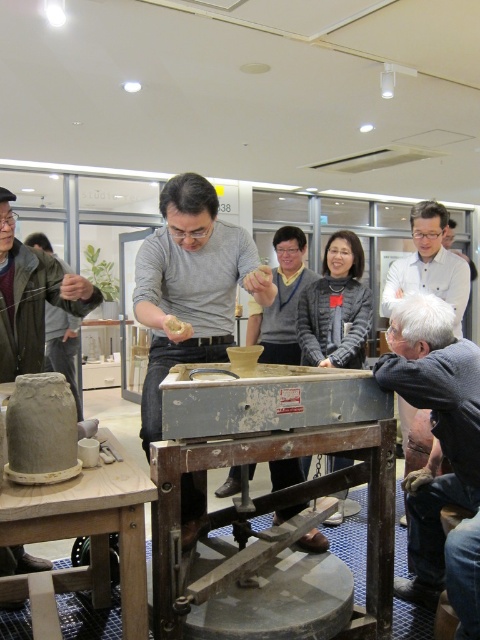
Question: Which object is farther from the camera taking this photo?

Choices:
 (A) rusty metal table at center
 (B) wooden table at lower left

Answer: (A)

Question: Does wooden table at lower left come behind gray wool sweater at center?

Choices:
 (A) no
 (B) yes

Answer: (A)

Question: Does rusty metal table at center appear under matte gray clay pot at left?

Choices:
 (A) no
 (B) yes

Answer: (B)

Question: Does rusty metal table at center have a greater width compared to wooden table at lower left?

Choices:
 (A) yes
 (B) no

Answer: (A)

Question: Among these objects, which one is nearest to the camera?

Choices:
 (A) gray matte shirt at center
 (B) green matte clay at center
 (C) gray wool sweater at lower right
 (D) rusty metal table at center

Answer: (D)

Question: Which point appears closest to the camera in this image?

Choices:
 (A) pos(170,326)
 (B) pos(421,385)
 (C) pos(75,506)
 (D) pos(40,275)

Answer: (C)